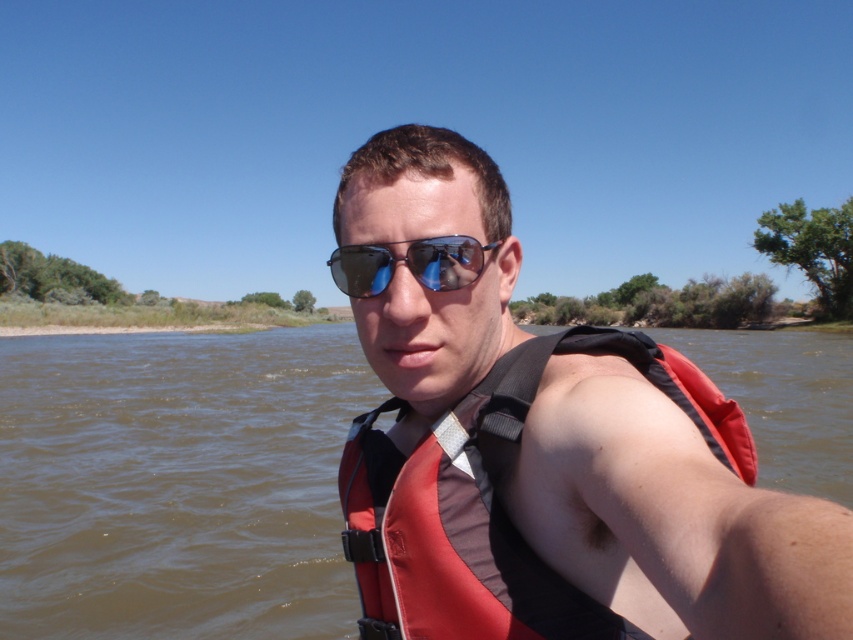
Looking at this image, does brown matte water at center appear under red fabric life jacket at center?

Incorrect, brown matte water at center is not positioned below red fabric life jacket at center.

Consider the image. Can you confirm if brown matte water at center is shorter than red fabric life jacket at center?

Incorrect, brown matte water at center's height does not fall short of red fabric life jacket at center's.

Describe the element at coordinates (177, 483) in the screenshot. I see `brown matte water at center` at that location.

Where is `brown matte water at center`? This screenshot has width=853, height=640. brown matte water at center is located at coordinates (177, 483).

Which is more to the right, brown matte water at center or blue reflective lenses at center?

blue reflective lenses at center is more to the right.

Which is below, brown matte water at center or blue reflective lenses at center?

blue reflective lenses at center is lower down.

I want to click on brown matte water at center, so click(x=177, y=483).

Can you confirm if red fabric life jacket at center is wider than blue reflective lenses at center?

Correct, the width of red fabric life jacket at center exceeds that of blue reflective lenses at center.

Can you confirm if red fabric life jacket at center is thinner than blue reflective lenses at center?

In fact, red fabric life jacket at center might be wider than blue reflective lenses at center.

Is point (341, 460) farther from viewer compared to point (466, 280)?

Yes, point (341, 460) is farther from viewer.

This screenshot has height=640, width=853. Find the location of `red fabric life jacket at center`. red fabric life jacket at center is located at coordinates (491, 502).